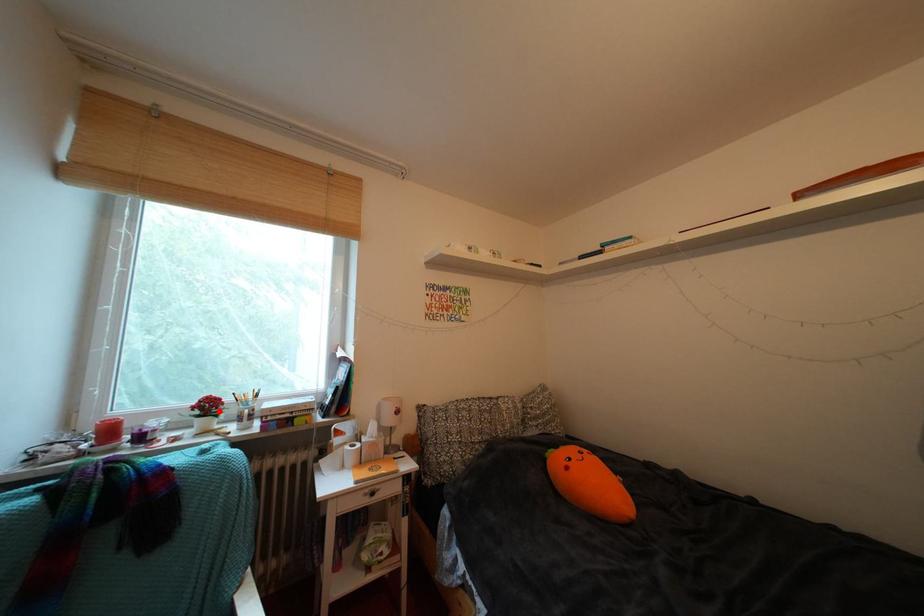
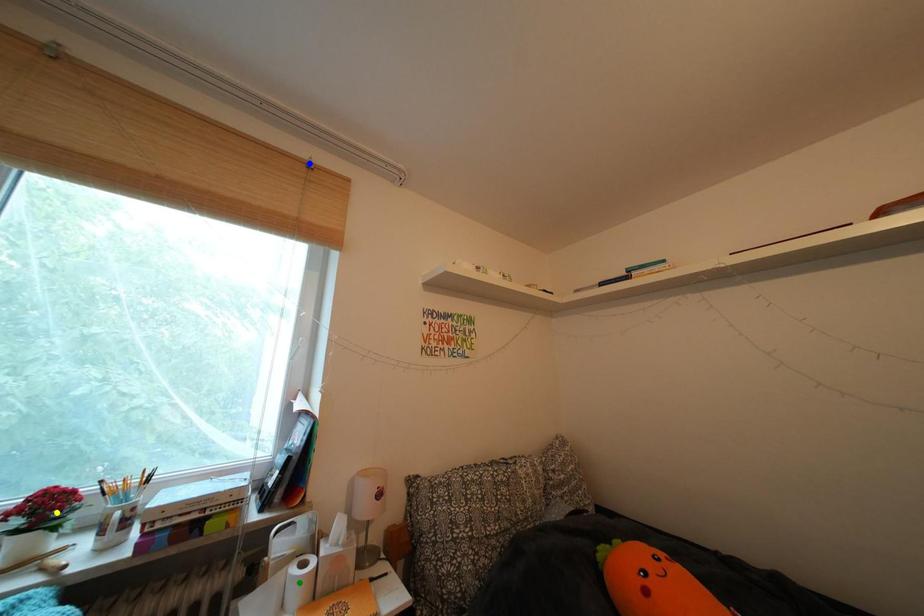
Question: I am providing you with two images of the same scene from different viewpoints. A red point is marked on the first image. You are given multiple points on the second image. Which spot in image 2 lines up with the point in image 1?

Choices:
 (A) blue point
 (B) yellow point
 (C) green point

Answer: (B)